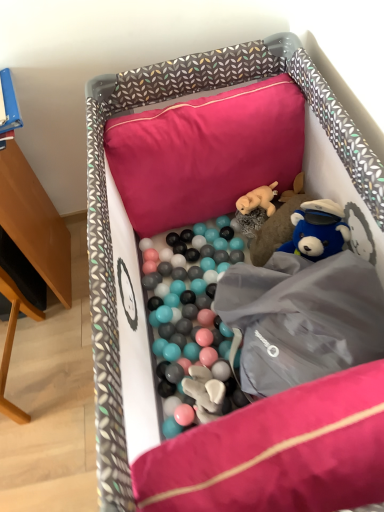
Question: Looking at their shapes, would you say fluffy plush bear at center, which appears as the second toy when viewed from the top, is wider or thinner than soft fabric playpen at center?

Choices:
 (A) thin
 (B) wide

Answer: (A)

Question: From the image's perspective, is fluffy plush bear at center, which appears as the second toy when viewed from the top, located above or below soft fabric playpen at center?

Choices:
 (A) below
 (B) above

Answer: (B)

Question: Based on their relative distances, which object is nearer to the pink fabric pillow at upper center?

Choices:
 (A) fuzzy beige dog at center, which is counted as the 1th toy, starting from the top
 (B) fluffy plush bear at center, which appears as the second toy when viewed from the top
 (C) soft fabric playpen at center

Answer: (A)

Question: Which is nearer to the fuzzy beige dog at center, acting as the second toy starting from the bottom?

Choices:
 (A) pink fabric pillow at upper center
 (B) fluffy plush bear at center, acting as the 1th toy starting from the bottom
 (C) soft fabric playpen at center

Answer: (B)